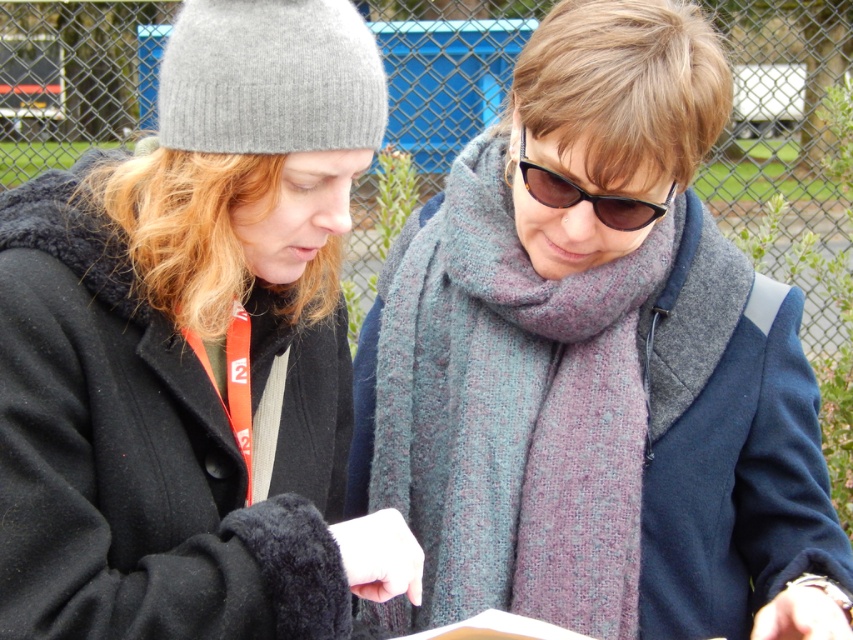
Question: Which point appears farthest from the camera in this image?

Choices:
 (A) (368, 480)
 (B) (386, 532)

Answer: (A)

Question: Is matte black coat at left positioned at the back of knitted wool scarf at center?

Choices:
 (A) no
 (B) yes

Answer: (A)

Question: Which point is closer to the camera?

Choices:
 (A) knitted wool scarf at center
 (B) matte black coat at left

Answer: (B)

Question: Which object is farther from the camera taking this photo?

Choices:
 (A) havana tortoiseshell sunglasses at center
 (B) matte black coat at left
 (C) knitted wool scarf at center

Answer: (C)

Question: Can you confirm if knitted wool scarf at center is positioned above havana tortoiseshell sunglasses at center?

Choices:
 (A) no
 (B) yes

Answer: (A)

Question: Does matte black coat at left have a smaller size compared to knitted wool scarf at center?

Choices:
 (A) no
 (B) yes

Answer: (A)